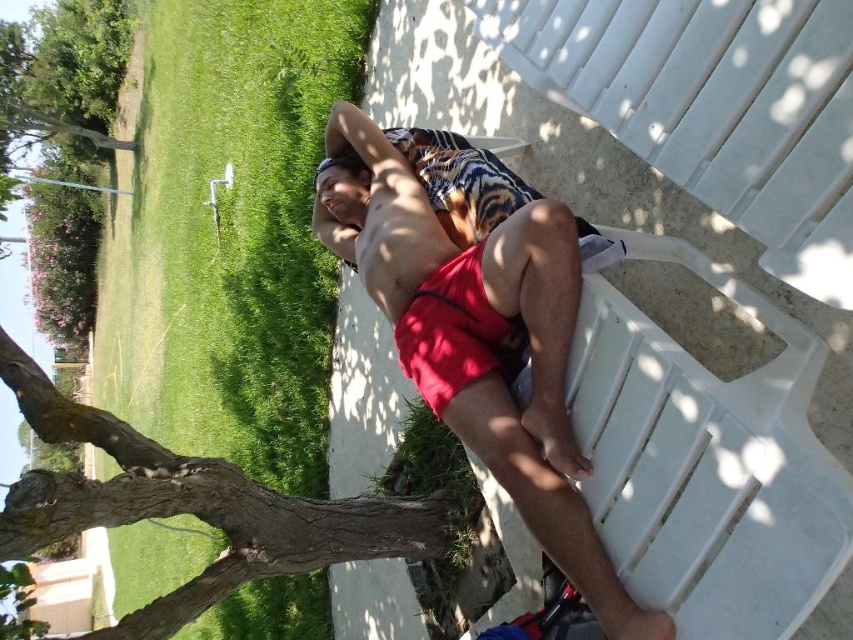
Between red fabric shorts at center and brown rough bark at lower left, which one has less height?

Standing shorter between the two is brown rough bark at lower left.

Is point (439, 257) positioned behind point (428, 532)?

That is False.

Which is behind, point (547, 440) or point (277, 566)?

The point (277, 566) is more distant.

This screenshot has width=853, height=640. Find the location of `red fabric shorts at center`. red fabric shorts at center is located at coordinates (479, 340).